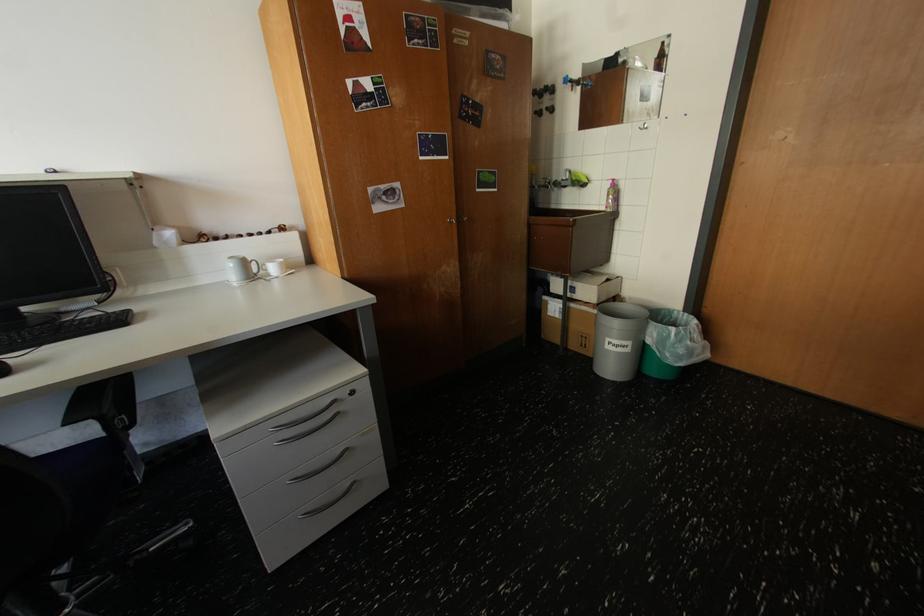
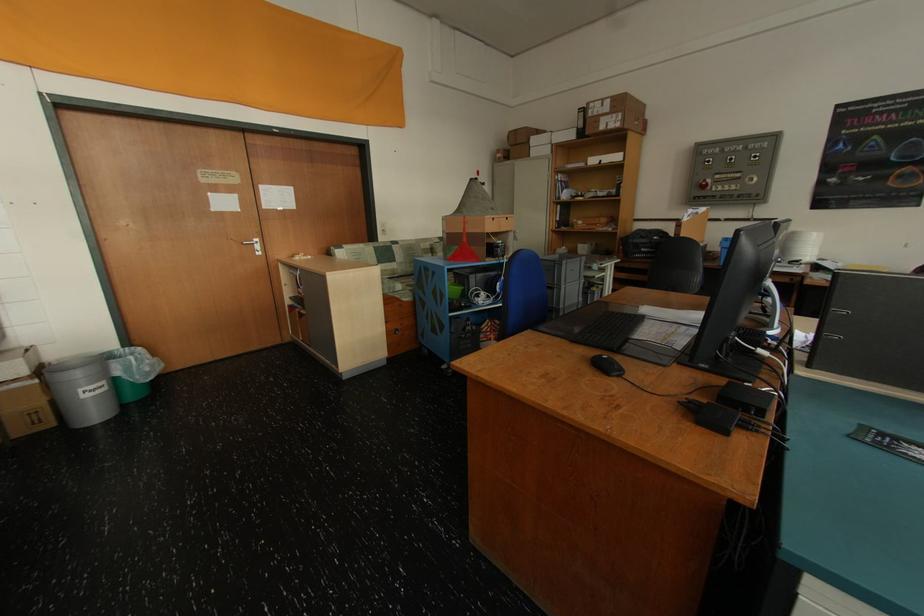
The point at [624,347] is marked in the first image. Where is the corresponding point in the second image?

(101, 392)